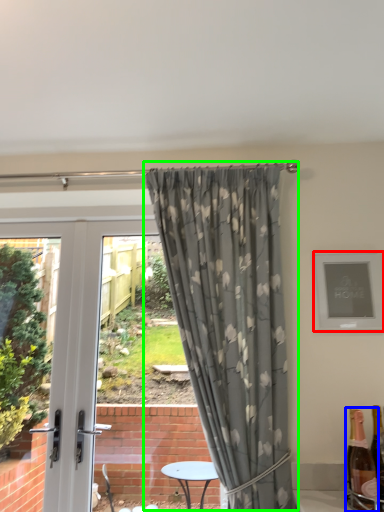
Question: Which object is positioned closest to picture frame (highlighted by a red box)? Select from bottle (highlighted by a blue box) and curtain (highlighted by a green box).

Choices:
 (A) bottle
 (B) curtain

Answer: (B)